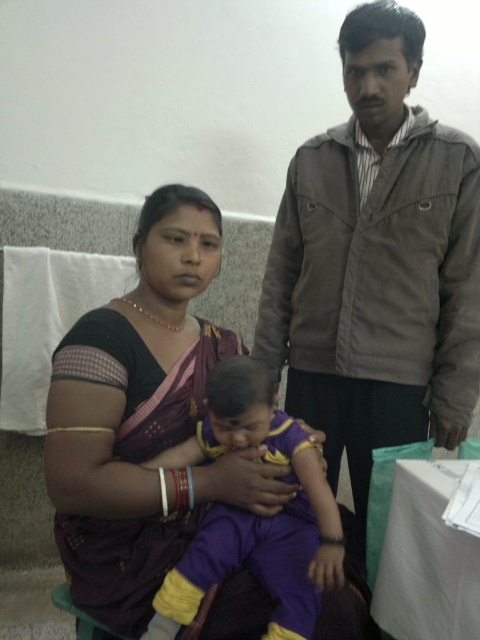
You are a photographer taking a picture of the scene. You want to ensure both the gray corduroy jacket at center and the purple silk saree at center are clearly visible. Which object should you focus on first if you need to adjust your camera focus starting from the left side?

You should focus on the purple silk saree at center first because it is positioned to the left of the gray corduroy jacket at center, so starting from the left side, it comes first.

You are a photographer setting up for a family portrait in the medical facility. You need to position the gray corduroy jacket at center and the purple fabric baby at center so that the baby is visible in the photo. Based on their current positions, which object should you move to ensure the baby is not blocked?

The gray corduroy jacket at center is to the right of the purple fabric baby at center. To ensure the baby is visible, you should move the gray corduroy jacket at center to the left so it no longer blocks the baby.

Consider the image. What is the exact location of the purple silk saree at center in the image?

The purple silk saree at center is located at point (142,419).